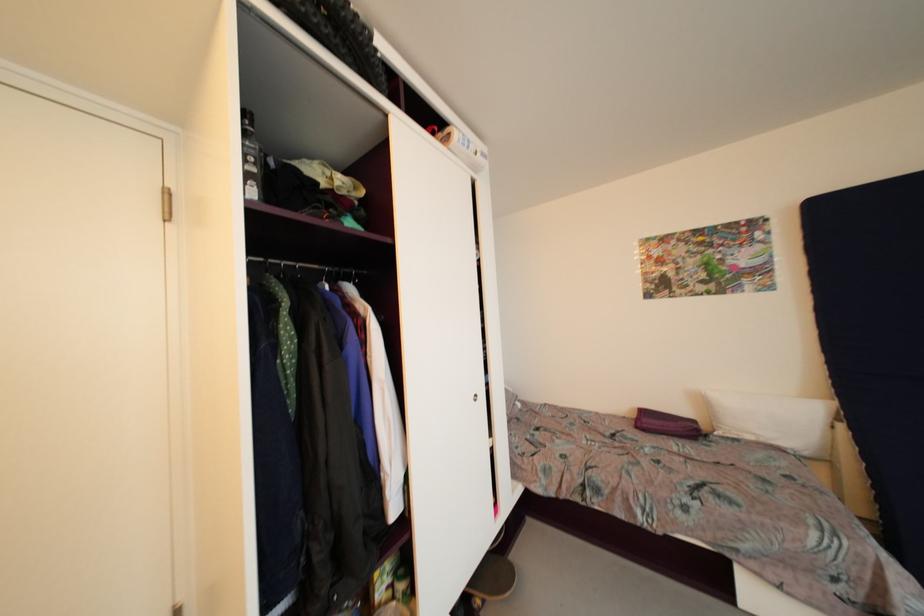
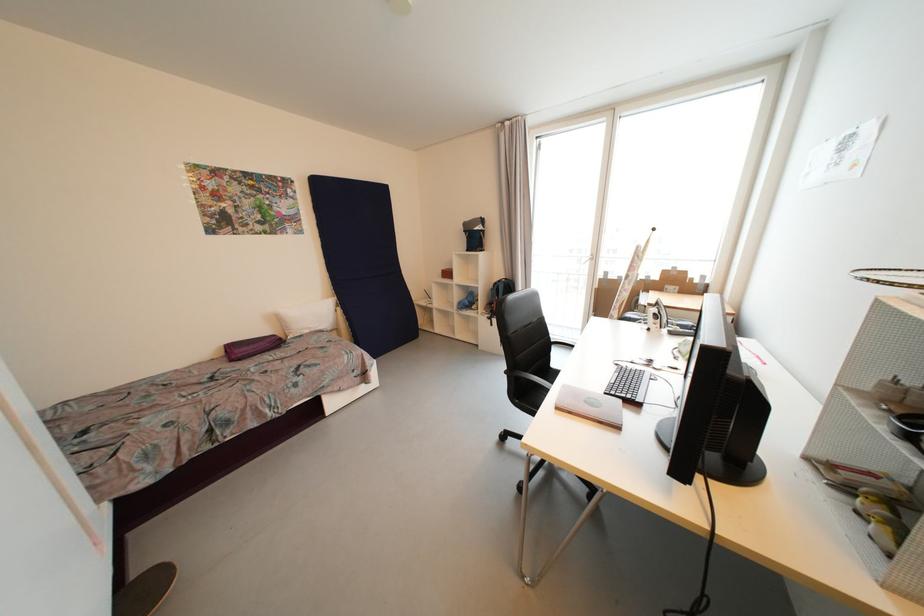
Where in the second image is the point corresponding to (x=518, y=554) from the first image?

(140, 578)